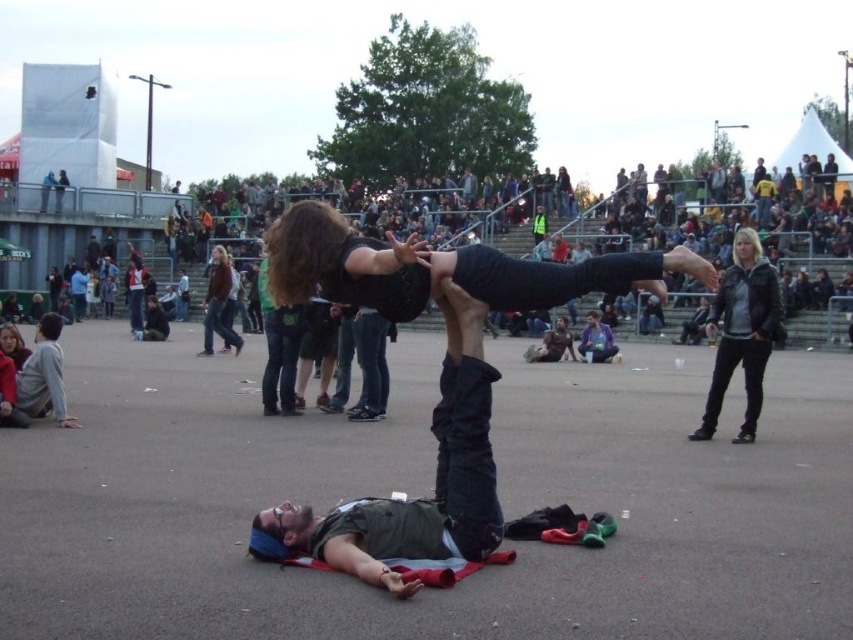
Can you confirm if black leather jacket at upper right is wider than light gray sweatshirt at lower left?

No.

Between point (735, 436) and point (33, 378), which one is positioned behind?

The point (735, 436) is behind.

Identify the location of black leather jacket at upper right. The width and height of the screenshot is (853, 640). (741, 332).

Can you confirm if dark green fabric at center is positioned to the right of black leather jacket at upper right?

No, dark green fabric at center is not to the right of black leather jacket at upper right.

Where is `dark green fabric at center`? This screenshot has height=640, width=853. dark green fabric at center is located at coordinates (413, 499).

The height and width of the screenshot is (640, 853). What do you see at coordinates (44, 376) in the screenshot?
I see `light gray sweatshirt at lower left` at bounding box center [44, 376].

Where is `light gray sweatshirt at lower left`? light gray sweatshirt at lower left is located at coordinates (44, 376).